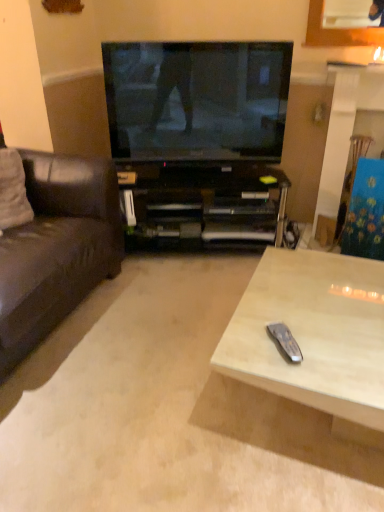
Question: Can you confirm if black plastic cabinet at center is smaller than white fabric pillow at left?

Choices:
 (A) yes
 (B) no

Answer: (B)

Question: Considering the relative sizes of black plastic cabinet at center and white fabric pillow at left in the image provided, is black plastic cabinet at center thinner than white fabric pillow at left?

Choices:
 (A) yes
 (B) no

Answer: (B)

Question: Is black plastic cabinet at center wider than white fabric pillow at left?

Choices:
 (A) yes
 (B) no

Answer: (A)

Question: Is black plastic cabinet at center placed right next to white fabric pillow at left?

Choices:
 (A) no
 (B) yes

Answer: (A)

Question: Does black plastic cabinet at center contain white fabric pillow at left?

Choices:
 (A) no
 (B) yes

Answer: (A)

Question: Is point (377, 496) positioned closer to the camera than point (276, 339)?

Choices:
 (A) closer
 (B) farther

Answer: (A)

Question: In the image, is wooden coffee table at center positioned in front of or behind silver metallic remote at lower right?

Choices:
 (A) behind
 (B) front

Answer: (B)

Question: Is wooden coffee table at center to the left or to the right of silver metallic remote at lower right in the image?

Choices:
 (A) left
 (B) right

Answer: (A)

Question: In terms of height, does wooden coffee table at center look taller or shorter compared to silver metallic remote at lower right?

Choices:
 (A) tall
 (B) short

Answer: (B)

Question: In terms of height, does brown leather couch at left look taller or shorter compared to wooden coffee table at center?

Choices:
 (A) tall
 (B) short

Answer: (A)

Question: From the image's perspective, is brown leather couch at left above or below wooden coffee table at center?

Choices:
 (A) above
 (B) below

Answer: (A)

Question: Considering the positions of brown leather couch at left and wooden coffee table at center in the image, is brown leather couch at left wider or thinner than wooden coffee table at center?

Choices:
 (A) thin
 (B) wide

Answer: (A)

Question: Is point (26, 309) closer or farther from the camera than point (238, 449)?

Choices:
 (A) farther
 (B) closer

Answer: (A)

Question: Is silver metallic remote at lower right inside or outside of black plastic cabinet at center?

Choices:
 (A) outside
 (B) inside

Answer: (A)

Question: Is silver metallic remote at lower right taller or shorter than black plastic cabinet at center?

Choices:
 (A) tall
 (B) short

Answer: (B)